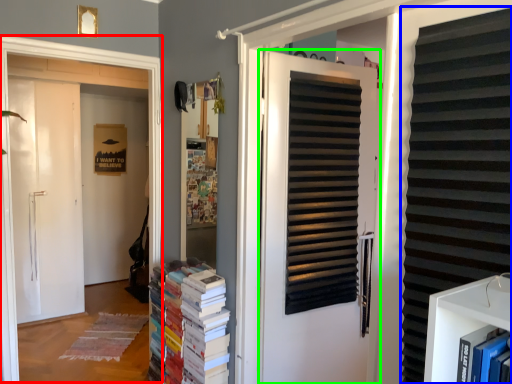
Question: Which is nearer to the window frame (highlighted by a red box)? shutter (highlighted by a blue box) or door (highlighted by a green box).

Choices:
 (A) shutter
 (B) door

Answer: (B)